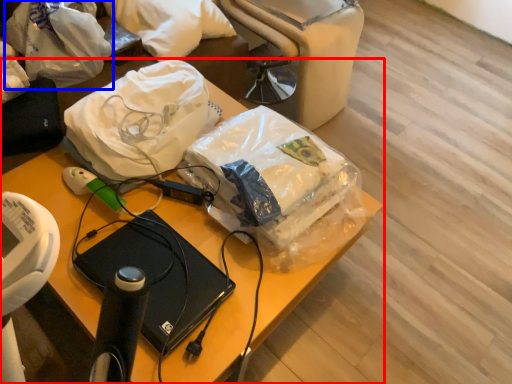
Question: Which of the following is the farthest to the observer, furniture (highlighted by a red box) or plastic bag (highlighted by a blue box)?

Choices:
 (A) furniture
 (B) plastic bag

Answer: (B)